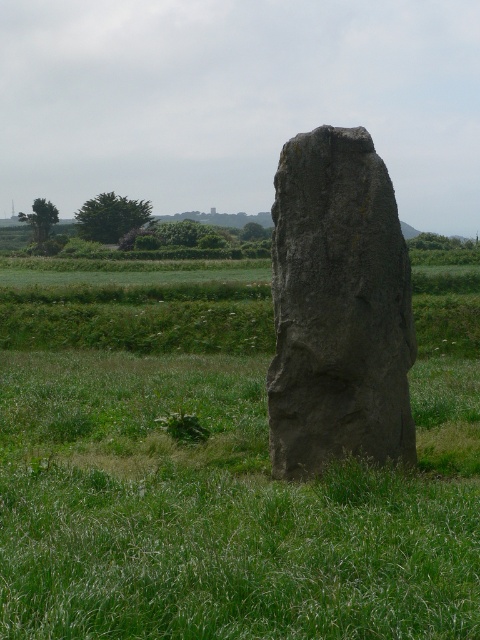
How much distance is there between gray stone monolith at center and gray rough stone at center?

gray stone monolith at center is 2.96 meters from gray rough stone at center.

The height and width of the screenshot is (640, 480). Describe the element at coordinates (217, 467) in the screenshot. I see `gray stone monolith at center` at that location.

The width and height of the screenshot is (480, 640). I want to click on gray stone monolith at center, so click(x=217, y=467).